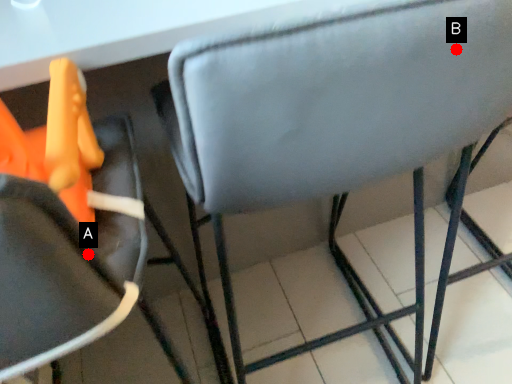
Question: Two points are circled on the image, labeled by A and B beside each circle. Among these points, which one is farthest from the camera?

Choices:
 (A) A is further
 (B) B is further

Answer: (B)